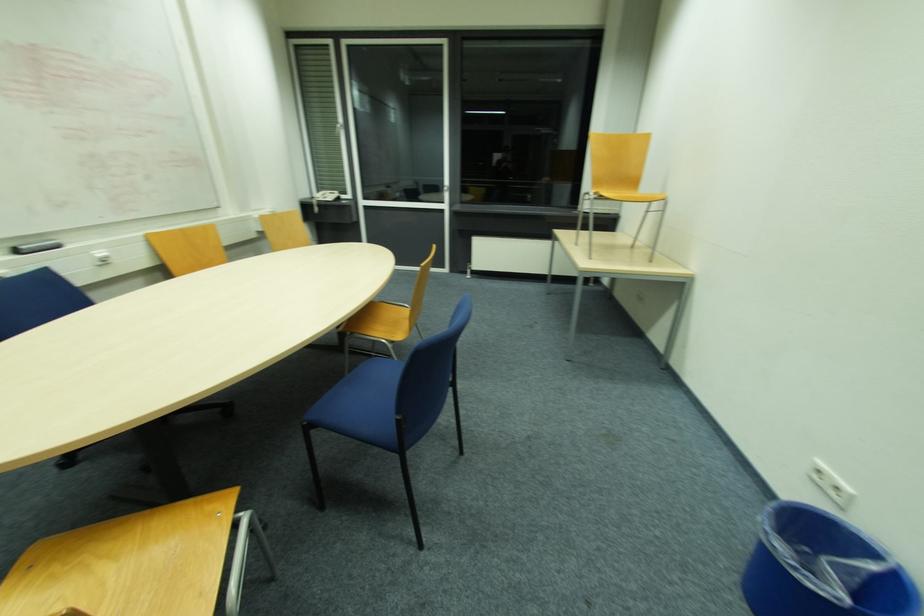
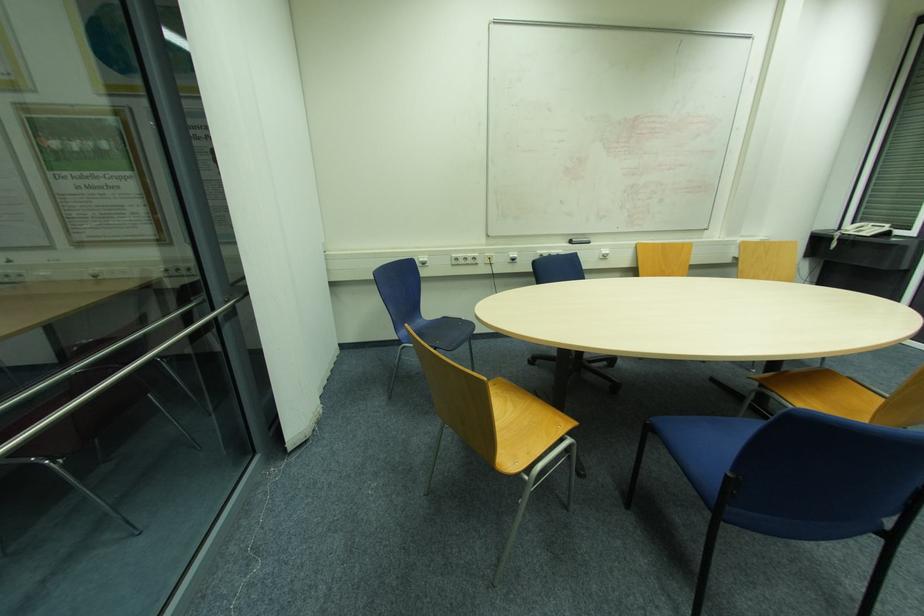
In the second image, find the point that corresponds to (101,256) in the first image.

(604, 253)